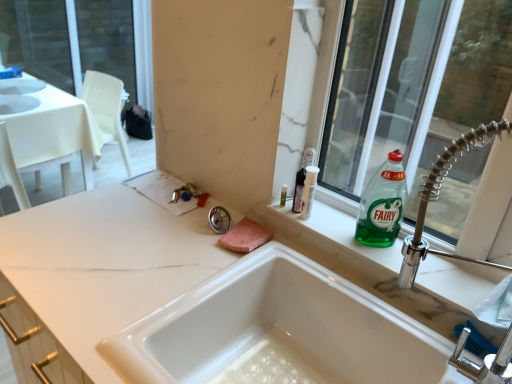
Question: Considering the positions of transparent glass window at upper right and white glossy sink at center in the image, is transparent glass window at upper right wider or thinner than white glossy sink at center?

Choices:
 (A) thin
 (B) wide

Answer: (A)

Question: From the image's perspective, relative to white glossy sink at center, is transparent glass window at upper right above or below?

Choices:
 (A) below
 (B) above

Answer: (B)

Question: Which is nearer to the white glossy sink at center?

Choices:
 (A) transparent glass window at upper right
 (B) translucent plastic bottle at upper right
 (C) white glossy sink at upper left
 (D) white marble countertop at center
 (E) green glass bottle at upper right

Answer: (D)

Question: Considering the real-world distances, which object is farthest from the white glossy sink at upper left?

Choices:
 (A) transparent glass window at upper right
 (B) white marble countertop at center
 (C) green glass bottle at upper right
 (D) white glossy sink at center
 (E) translucent plastic bottle at upper right

Answer: (C)